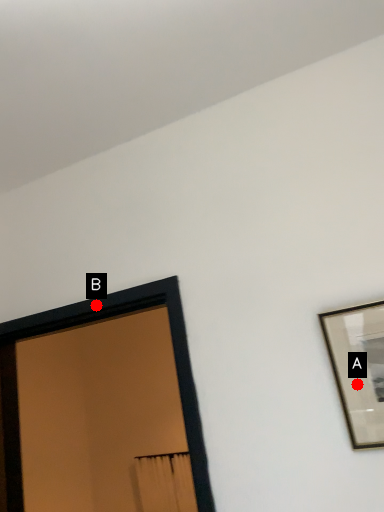
Question: Two points are circled on the image, labeled by A and B beside each circle. Which point is farther from the camera taking this photo?

Choices:
 (A) A is further
 (B) B is further

Answer: (B)